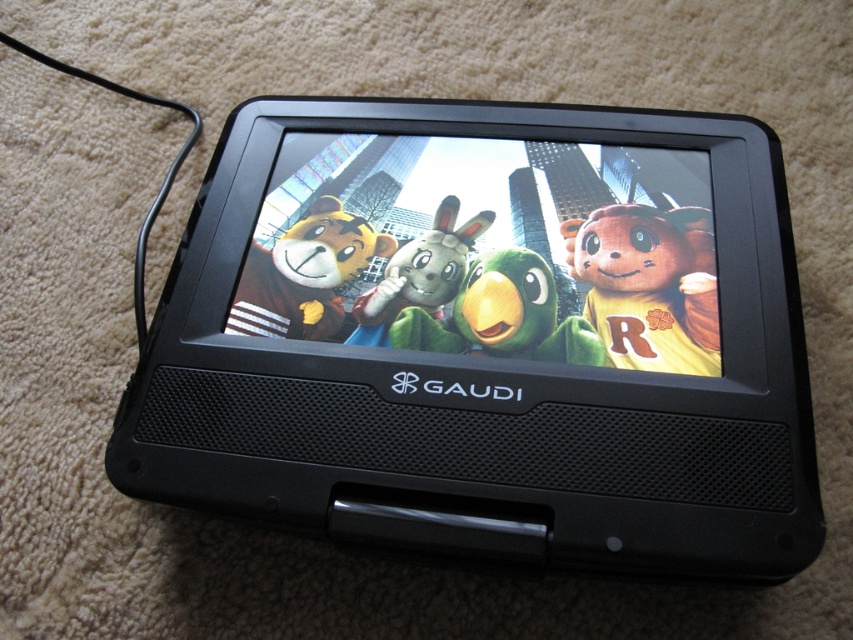
Question: Which object appears closest to the camera in this image?

Choices:
 (A) matte plush bear at center
 (B) matte plastic screen at center
 (C) velvety green bird at center
 (D) black plastic portable dvd player at center

Answer: (D)

Question: Does black plastic portable dvd player at center appear over velvety green bird at center?

Choices:
 (A) no
 (B) yes

Answer: (B)

Question: Does matte plush bear at center have a larger size compared to green plush rabbit at center?

Choices:
 (A) no
 (B) yes

Answer: (B)

Question: Does black plastic portable dvd player at center have a lesser width compared to matte plastic screen at center?

Choices:
 (A) no
 (B) yes

Answer: (A)

Question: Among these points, which one is nearest to the camera?

Choices:
 (A) (415, 324)
 (B) (465, 240)
 (C) (442, 484)
 (D) (282, 298)

Answer: (C)

Question: Which point appears closest to the camera in this image?

Choices:
 (A) (341, 236)
 (B) (680, 230)
 (C) (703, 308)

Answer: (C)